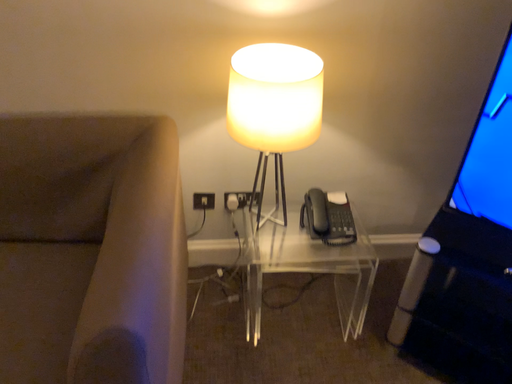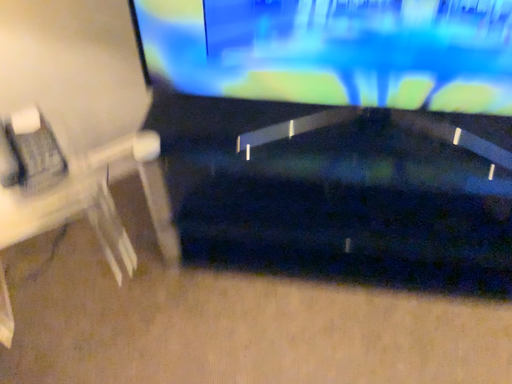
Question: Which way did the camera rotate in the video?

Choices:
 (A) rotated upward
 (B) rotated downward

Answer: (B)